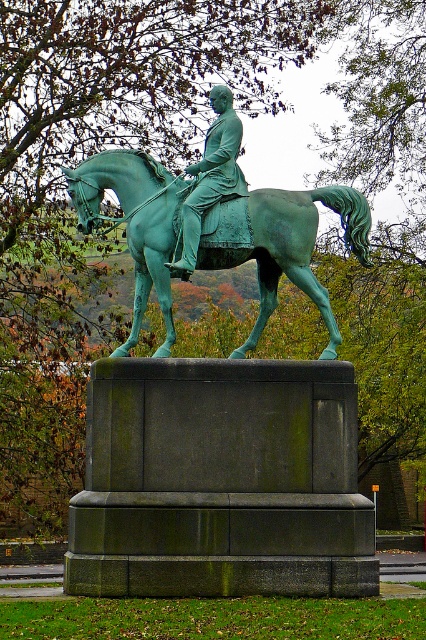
You are standing in front of the equestrian statue and want to take a photo of the point at coordinate point (x=259, y=376). The camera you have can focus on objects up to 40 meters away. Will the camera be able to focus on the point?

The distance of point (x=259, y=376) from viewer is 42.84 meters, which is beyond the camera focus limit of 40 meters. The camera will not be able to focus on the point.

You are a city planner analyzing the placement of the green patinated bronze statue at center in the image. The statue is marked by the point coordinates point (218, 406). Based on the scene description, what is the significance of this coordinate point in relation to the statue?

The point (218, 406) represents the location of the green patinated bronze statue at center in the image. This coordinate indicates where the statue is positioned spatially within the scene.